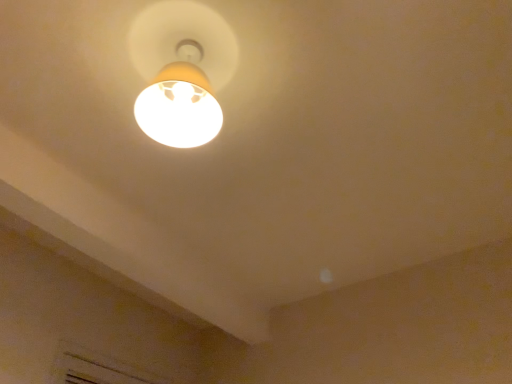
The width and height of the screenshot is (512, 384). Identify the location of matte white lampshade at upper center. (181, 71).

Describe the element at coordinates (181, 71) in the screenshot. Image resolution: width=512 pixels, height=384 pixels. I see `matte white lampshade at upper center` at that location.

Where is `matte white lampshade at upper center`? matte white lampshade at upper center is located at coordinates (181, 71).